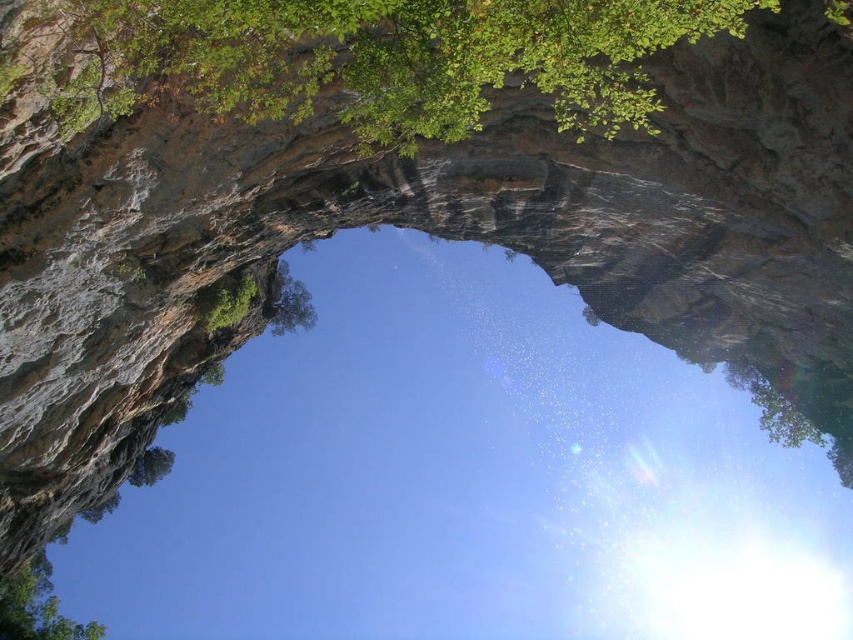
Question: Can you confirm if transparent water at center is bigger than green leafy tree at lower left?

Choices:
 (A) no
 (B) yes

Answer: (B)

Question: Can you confirm if transparent water at center is wider than green leafy tree at lower left?

Choices:
 (A) no
 (B) yes

Answer: (B)

Question: Among these points, which one is nearest to the camera?

Choices:
 (A) (554, 579)
 (B) (427, 129)
 (C) (3, 596)

Answer: (B)

Question: Which object appears closest to the camera in this image?

Choices:
 (A) transparent water at center
 (B) green leafy tree at upper center

Answer: (B)

Question: Does green leafy tree at upper center have a larger size compared to green leafy tree at lower left?

Choices:
 (A) no
 (B) yes

Answer: (A)

Question: Which object appears closest to the camera in this image?

Choices:
 (A) transparent water at center
 (B) green leafy tree at upper center

Answer: (B)